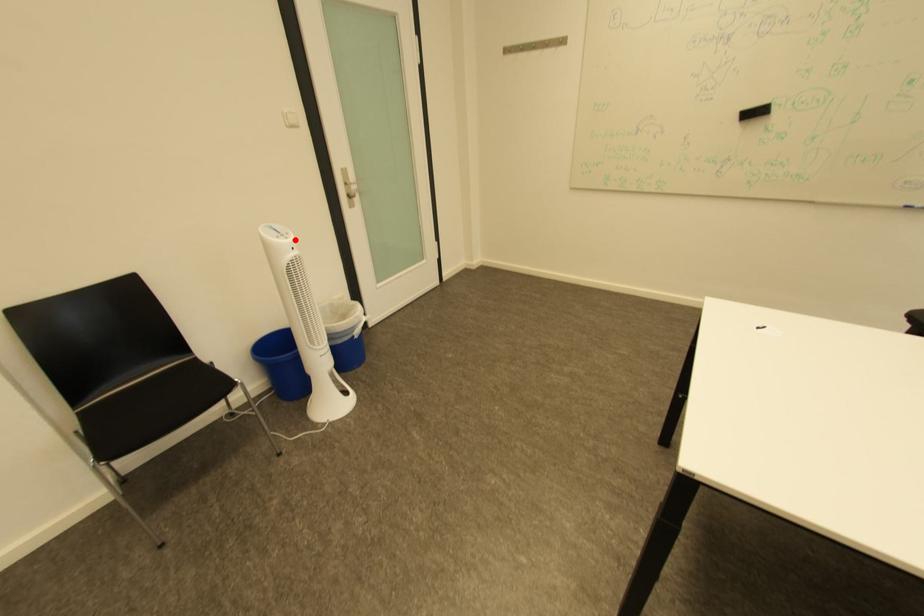
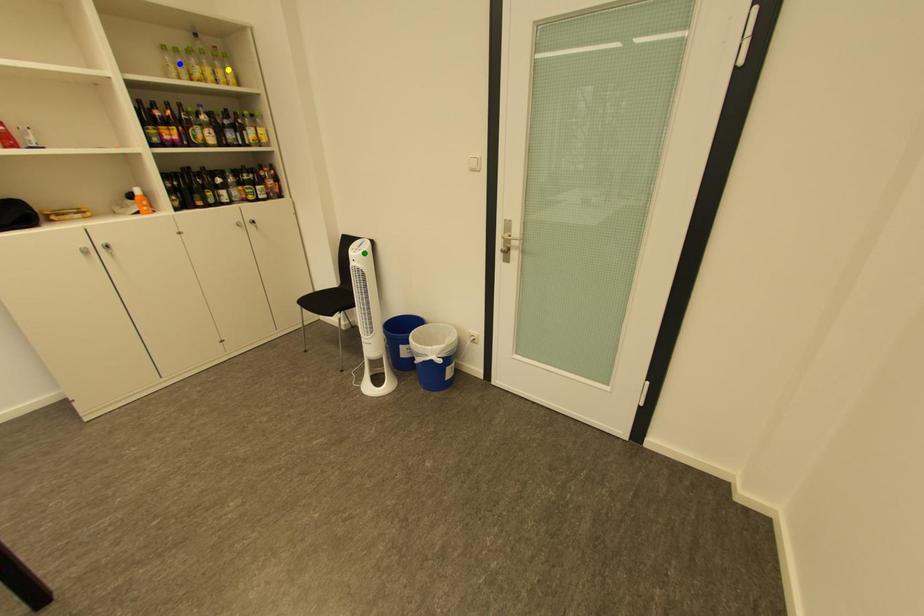
Question: I am providing you with two images of the same scene from different viewpoints. A red point is marked on the first image. You are given multiple points on the second image. Which point in image 2 is actually the same real-world point as the red point in image 1?

Choices:
 (A) yellow point
 (B) blue point
 (C) green point

Answer: (C)